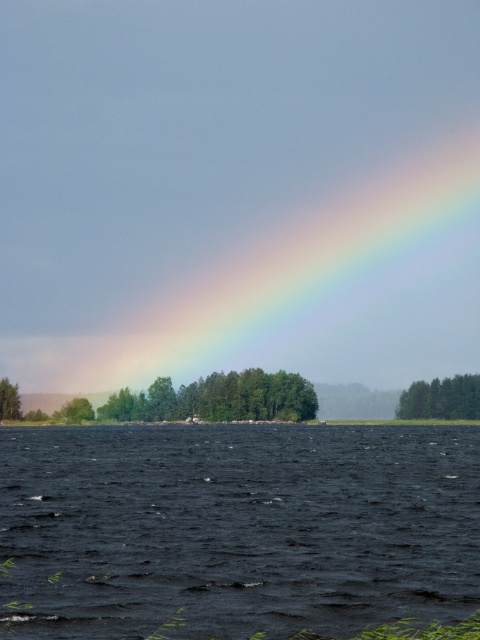
Question: Does green matte tree at lower right appear under green leafy tree at left?

Choices:
 (A) yes
 (B) no

Answer: (B)

Question: Where is green matte tree at left located in relation to green leafy tree at left in the image?

Choices:
 (A) right
 (B) left

Answer: (B)

Question: Which of the following is the farthest from the observer?

Choices:
 (A) green matte tree at lower right
 (B) green leafy trees at center
 (C) dark blue water at center

Answer: (A)

Question: In this image, where is green leafy trees at center located relative to green matte tree at lower right?

Choices:
 (A) right
 (B) left

Answer: (B)

Question: Which point is closer to the camera?

Choices:
 (A) green matte tree at lower right
 (B) green leafy trees at center
 (C) green matte tree at left
 (D) green leafy tree at left

Answer: (C)

Question: Which of these objects is positioned farthest from the green leafy trees at center?

Choices:
 (A) dark blue water at center
 (B) green matte tree at lower right

Answer: (A)